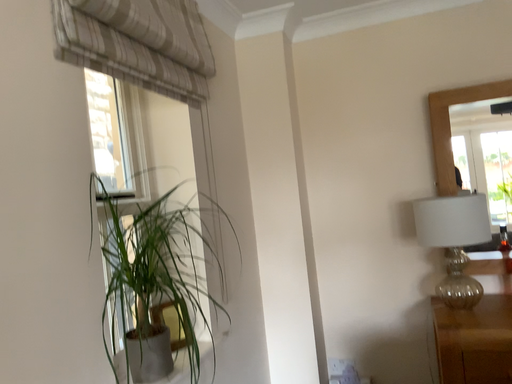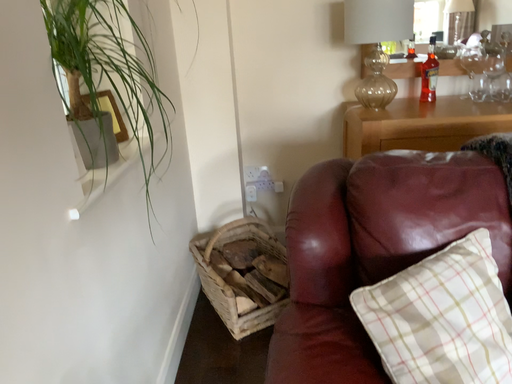
Question: Which way did the camera rotate in the video?

Choices:
 (A) rotated downward
 (B) rotated upward

Answer: (A)